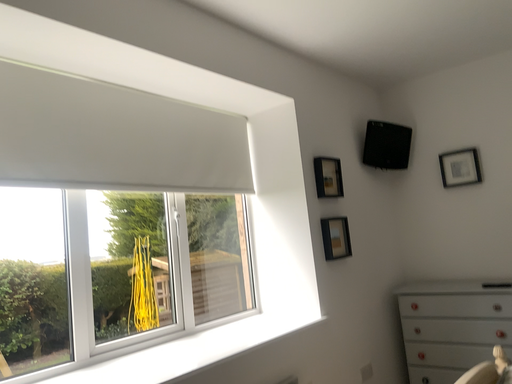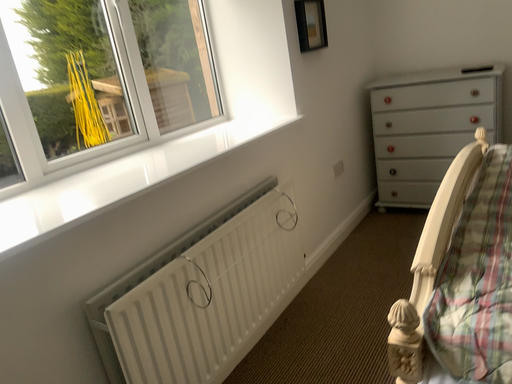
Question: How did the camera likely rotate when shooting the video?

Choices:
 (A) rotated upward
 (B) rotated downward

Answer: (B)